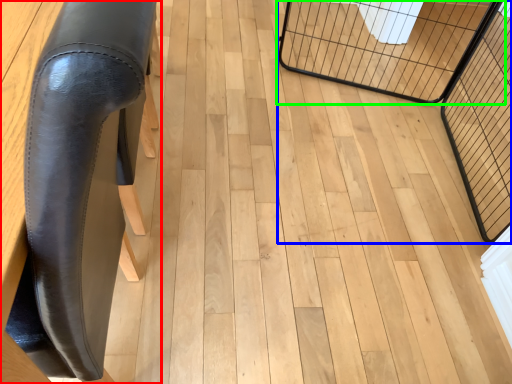
Question: Considering the real-world distances, which object is closest to furniture (highlighted by a red box)? cage (highlighted by a blue box) or cage (highlighted by a green box).

Choices:
 (A) cage
 (B) cage

Answer: (A)